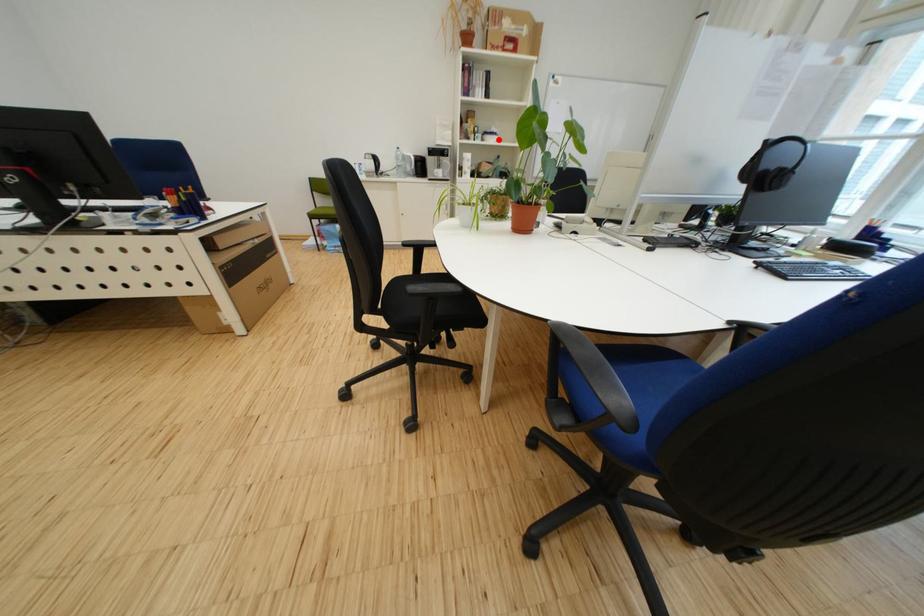
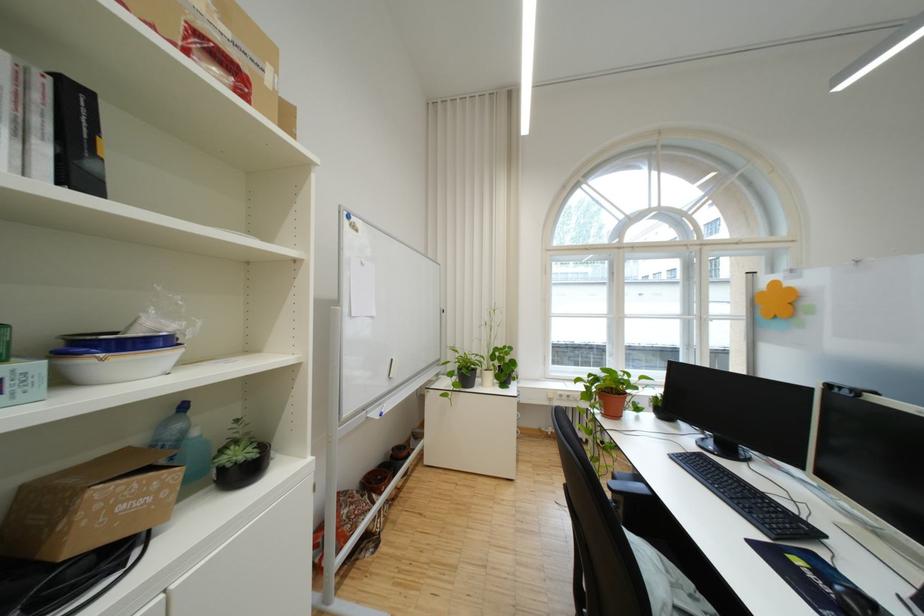
Locate, in the second image, the point that corresponds to the highlighted location in the first image.

(117, 365)